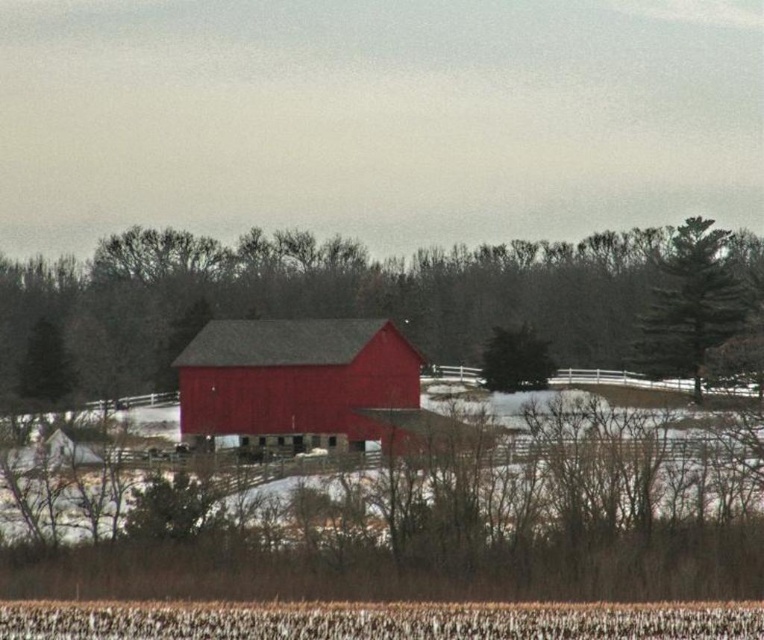
You are standing in the snowy field in front of the barn. A drone is flying above you and drops a package. The package lands at point (293, 380). Where did the package land?

The package landed at the matte red barn at center, which is represented by point (293, 380).

You are a farmer checking the dimensions of your property. You need to know which object is wider between the matte red barn at center and the green textured tree at upper right. Which one is wider?

The matte red barn at center is wider than the green textured tree at upper right.

You are standing in the snowy field and want to take a photo of the green textured tree at upper right and the green matte tree at center. Which tree should you point your camera towards first if you want to capture both in a single shot without moving the camera?

The green textured tree at upper right is located above the green matte tree at center, so you should point your camera towards the green textured tree at upper right first to ensure both are in frame.